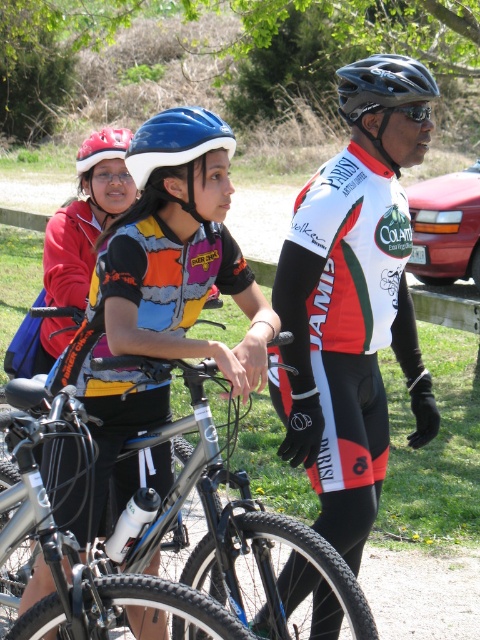
Question: Can you confirm if shiny black helmet at center is positioned to the right of black matte goggles at upper center?

Choices:
 (A) no
 (B) yes

Answer: (B)

Question: Which object appears farthest from the camera in this image?

Choices:
 (A) blue matte helmet at center
 (B) shiny black helmet at center
 (C) silver metallic bicycle at center

Answer: (B)

Question: Does red matte helmet at upper left have a greater width compared to black matte goggles at upper center?

Choices:
 (A) yes
 (B) no

Answer: (A)

Question: Is silver metallic bicycle at center positioned behind matte black helmet at center?

Choices:
 (A) no
 (B) yes

Answer: (A)

Question: Which point is farther to the camera?

Choices:
 (A) (407, 108)
 (B) (168, 154)

Answer: (A)

Question: Which of the following is the farthest from the observer?

Choices:
 (A) (96, 145)
 (B) (131, 525)

Answer: (A)